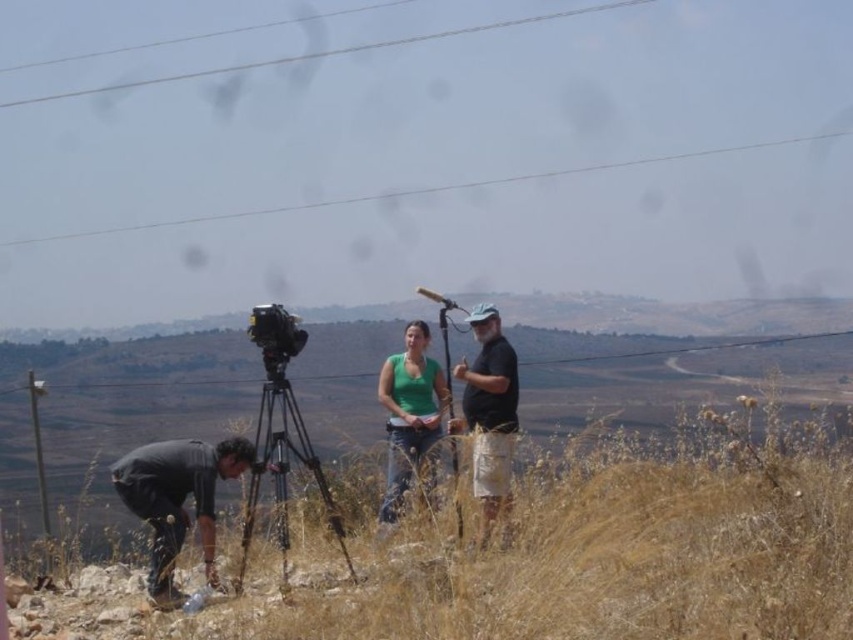
You are a photographer trying to capture a clear shot of the metallic silver video camera at center without the dark gray fabric shirt at center blocking it. Based on their positions, can you adjust your angle to avoid the shirt?

The dark gray fabric shirt at center is closer to the viewer than the metallic silver video camera at center, so adjusting your angle downward might allow you to see the metallic silver video camera at center behind the shirt.

You are a photographer trying to set up your equipment. You have a dark gray fabric shirt at center and a white wire at upper center in your view. Which object is positioned more to the left?

The white wire at upper center is positioned more to the left than the dark gray fabric shirt at center.

You are a photographer trying to capture a wide shot of the scene. You have a camera with a 35mm lens that can capture a width of 60cm. The dark gray fabric shirt at center and the metallic silver video camera at center are both in your frame. Which object should you focus on to ensure it fits entirely within your shot?

The dark gray fabric shirt at center might be wider than the metallic silver video camera at center, so focusing on the metallic silver video camera at center would give a better chance of fitting within the 60cm width.